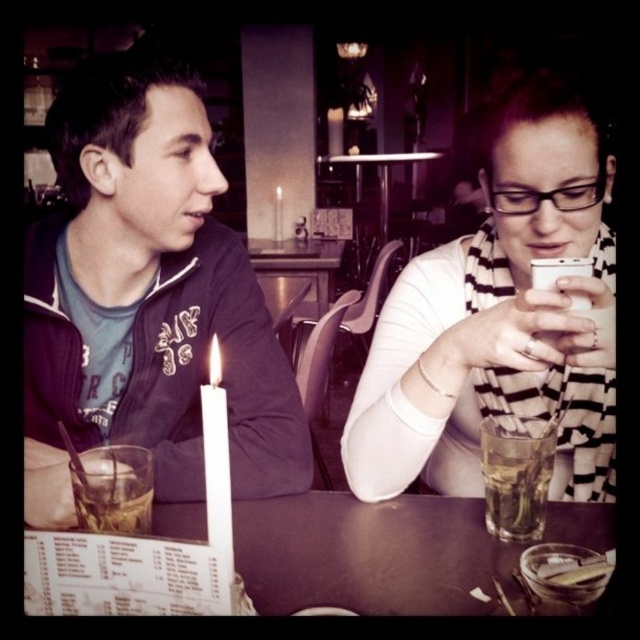
Question: In this image, where is matte black jacket at left located relative to translucent glass at table left?

Choices:
 (A) below
 (B) above

Answer: (B)

Question: Does white striped scarf at center have a smaller size compared to white wax candle at center?

Choices:
 (A) no
 (B) yes

Answer: (A)

Question: From the image, what is the correct spatial relationship of white striped scarf at center in relation to white matte candle at left?

Choices:
 (A) right
 (B) left

Answer: (A)

Question: Which of the following is the closest to the observer?

Choices:
 (A) translucent glass at table left
 (B) white striped scarf at center
 (C) white wax candle at center
 (D) white paper menu at lower left

Answer: (A)

Question: Which point appears farthest from the camera in this image?

Choices:
 (A) pos(170,477)
 (B) pos(532,420)
 (C) pos(108,516)
 (D) pos(557,304)

Answer: (A)

Question: Estimate the real-world distances between objects in this image. Which object is farther from the matte black jacket at center?

Choices:
 (A) clear glass at table right
 (B) white wax candle at center
 (C) white striped scarf at center

Answer: (B)